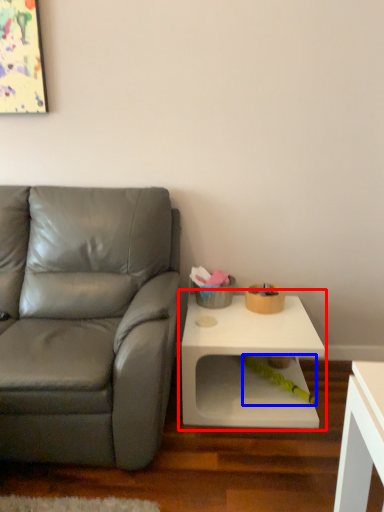
Question: Which point is closer to the camera, table (highlighted by a red box) or toy (highlighted by a blue box)?

Choices:
 (A) table
 (B) toy

Answer: (A)